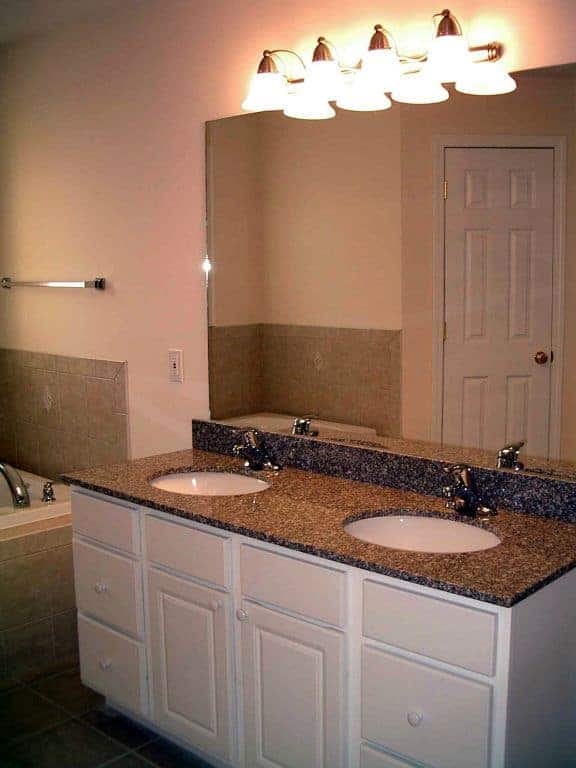
Identify the location of sink 1. Image resolution: width=576 pixels, height=768 pixels. (414, 535).